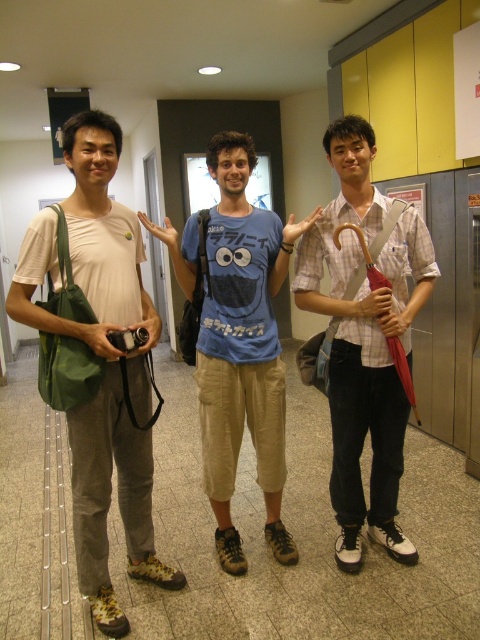
Who is positioned more to the left, matte green bag at left or plaid cotton shirt at center?

From the viewer's perspective, matte green bag at left appears more on the left side.

Does point (78, 352) lie in front of point (344, 289)?

That is True.

At what (x,y) coordinates should I click in order to perform the action: click on matte green bag at left. Please return your answer as a coordinate pair (x, y). Image resolution: width=480 pixels, height=640 pixels. Looking at the image, I should click on (96, 358).

Is point (362, 404) closer to viewer compared to point (264, 472)?

Yes, point (362, 404) is closer to viewer.

Which is in front, point (363, 141) or point (240, 560)?

Point (363, 141) is in front.

Identify the location of plaid cotton shirt at center. (364, 339).

Does matte green bag at left lie in front of blue cotton t-shirt at center?

That is True.

In the scene shown: Who is more forward, [81,266] or [184,284]?

Positioned in front is point [81,266].

Between point (94, 515) and point (265, 428), which one is positioned in front?

Point (94, 515) is in front.

The image size is (480, 640). What are the coordinates of `matte green bag at left` in the screenshot? It's located at (96, 358).